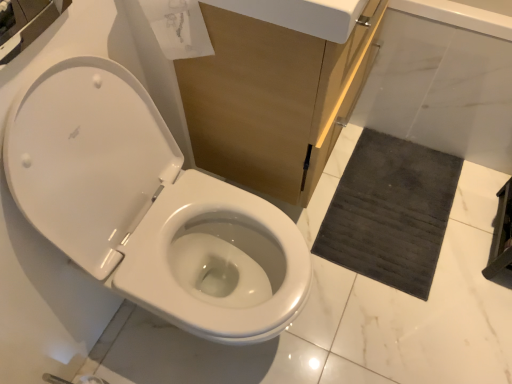
At what (x,y) coordinates should I click in order to perform the action: click on vacant space underneath dark gray textured bath mat at lower right (from a real-world perspective). Please return your answer as a coordinate pair (x, y). This screenshot has height=384, width=512. Looking at the image, I should click on point(389,209).